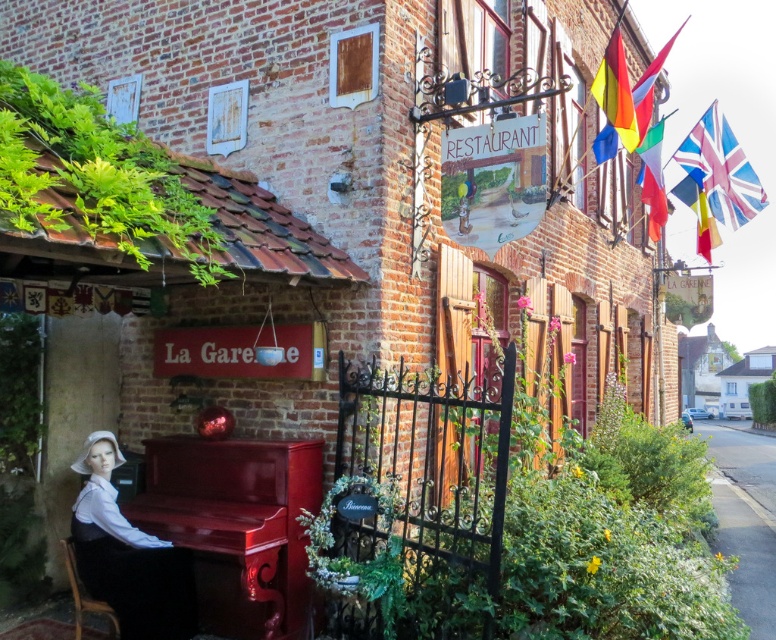
You are a customer entering the restaurant and notice two items in the entrance area. One is the smooth white blouse at lower left and the other is the yellow fabric flag at upper right. Which item is positioned lower in the scene?

The smooth white blouse at lower left is positioned lower than the yellow fabric flag at upper right.

You are a guest arriving at the restaurant and want to sit down immediately. Which object, the wooden chair at lower left or the blue fabric flag at upper right, is more suitable for sitting?

The wooden chair at lower left is more suitable for sitting because it has a greater height compared to the blue fabric flag at upper right, making it a proper seating option.